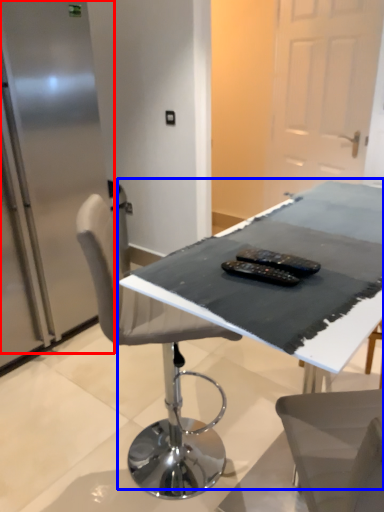
Question: Among these objects, which one is nearest to the camera, fridge (highlighted by a red box) or table (highlighted by a blue box)?

Choices:
 (A) fridge
 (B) table

Answer: (B)